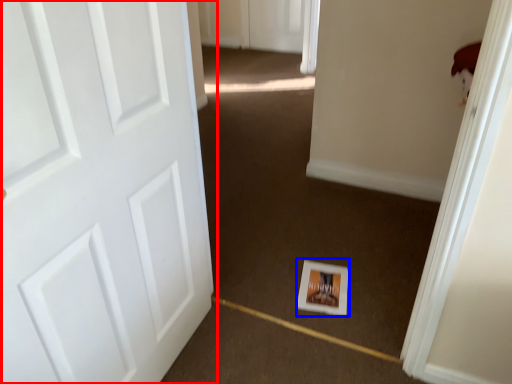
Question: Among these objects, which one is farthest to the camera, door (highlighted by a red box) or postcard (highlighted by a blue box)?

Choices:
 (A) door
 (B) postcard

Answer: (B)